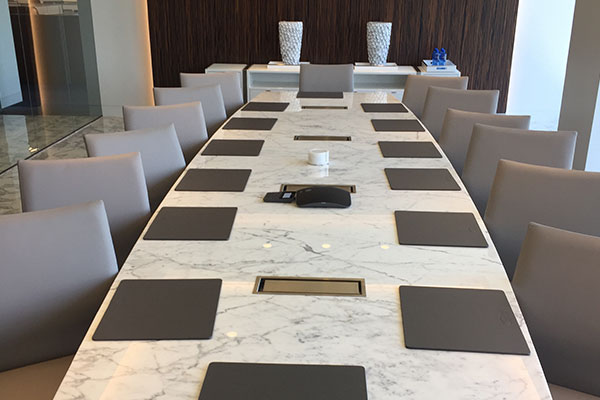
Image resolution: width=600 pixels, height=400 pixels. I want to click on white wall/blank, so click(x=526, y=52).